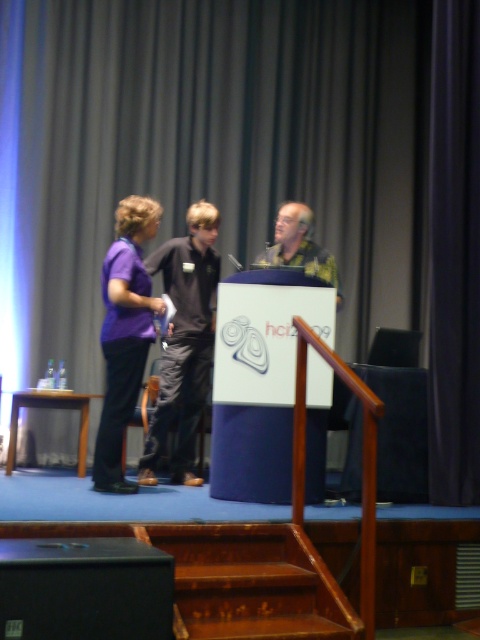
At what (x,y) coordinates should I click in order to perform the action: click on black matte speaker at lower left. Please return your answer as a coordinate pair (x, y). Looking at the image, I should click on (84, 588).

Identify the location of black matte speaker at lower left. The height and width of the screenshot is (640, 480). (84, 588).

Image resolution: width=480 pixels, height=640 pixels. Identify the location of black matte speaker at lower left. (84, 588).

Does black matte speaker at lower left appear on the left side of yellow-green textured shirt at center?

Yes, black matte speaker at lower left is to the left of yellow-green textured shirt at center.

Who is higher up, black matte speaker at lower left or yellow-green textured shirt at center?

yellow-green textured shirt at center is higher up.

Is point (85, 604) less distant than point (291, 221)?

Yes.

This screenshot has width=480, height=640. I want to click on black matte speaker at lower left, so click(84, 588).

Does purple fabric shirt at left have a larger size compared to yellow-green textured shirt at center?

Yes.

Is point (157, 404) less distant than point (298, 244)?

Yes.

Where is `purple fabric shirt at left`? The width and height of the screenshot is (480, 640). purple fabric shirt at left is located at coordinates (183, 340).